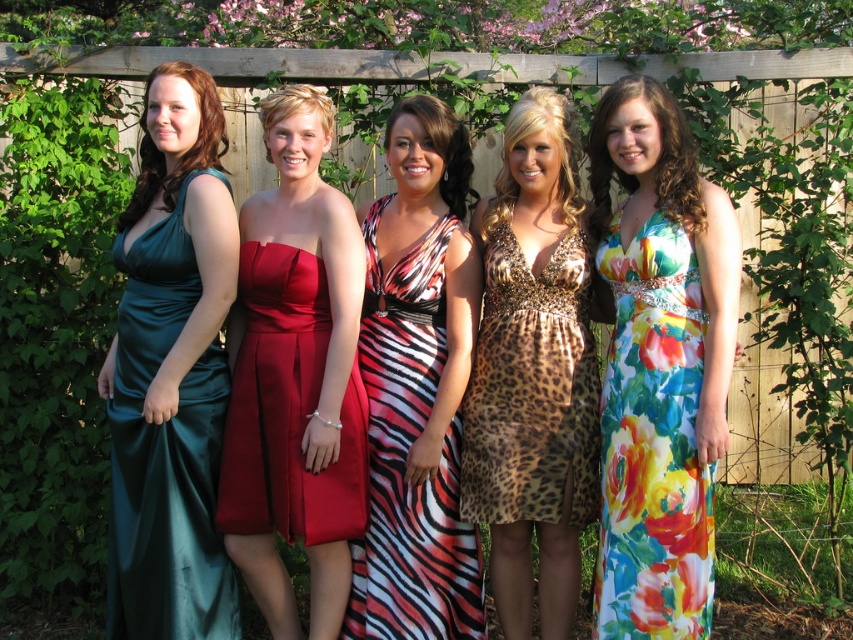
Question: Which object is positioned closest to the satin red dress at center?

Choices:
 (A) teal satin dress at left
 (B) floral silk dress at right

Answer: (A)

Question: Is floral silk dress at right bigger than satin red dress at center?

Choices:
 (A) yes
 (B) no

Answer: (A)

Question: Can you confirm if floral silk dress at right is positioned above satin red dress at center?

Choices:
 (A) no
 (B) yes

Answer: (A)

Question: Is teal satin dress at left smaller than satin red dress at center?

Choices:
 (A) yes
 (B) no

Answer: (B)

Question: Which point is farther from the camera taking this photo?

Choices:
 (A) (402, 572)
 (B) (144, 573)

Answer: (A)

Question: Which point is farther to the camera?

Choices:
 (A) teal satin dress at left
 (B) leopard print dress at center
 (C) zebra print dress at center

Answer: (C)